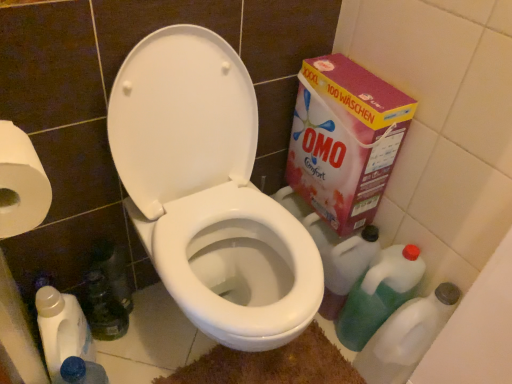
I want to click on free space above brown textured bath mat at lower center (from a real-world perspective), so click(x=265, y=369).